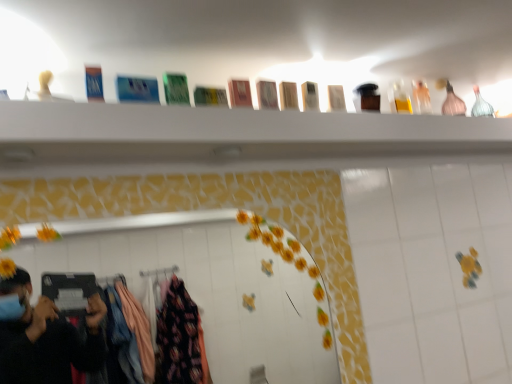
Describe the element at coordinates (230, 135) in the screenshot. I see `wooden boxes at upper center` at that location.

Describe the element at coordinates (215, 289) in the screenshot. This screenshot has width=512, height=384. I see `white glossy mirror at center` at that location.

What is the approximate width of white glossy mirror at center?

white glossy mirror at center is 3.43 centimeters wide.

This screenshot has height=384, width=512. I want to click on wooden boxes at upper center, so click(230, 135).

Would you say pink glass bottle at upper right is inside or outside white glossy mirror at center?

pink glass bottle at upper right is not inside white glossy mirror at center, it's outside.

How many degrees apart are the facing directions of pink glass bottle at upper right and white glossy mirror at center?

The angular difference between pink glass bottle at upper right and white glossy mirror at center is 1.3 degrees.

Is pink glass bottle at upper right touching white glossy mirror at center?

pink glass bottle at upper right is not next to white glossy mirror at center, and they're not touching.

Is wooden boxes at upper center looking in the opposite direction of white glossy mirror at center?

No.

Between wooden boxes at upper center and white glossy mirror at center, which one is positioned behind?

white glossy mirror at center is more distant.

Can you confirm if wooden boxes at upper center is thinner than white glossy mirror at center?

No, wooden boxes at upper center is not thinner than white glossy mirror at center.

Consider the image. From a real-world perspective, is wooden boxes at upper center positioned above or below white glossy mirror at center?

Clearly, from a real-world perspective, wooden boxes at upper center is above white glossy mirror at center.

This screenshot has width=512, height=384. In order to click on mirror that is below the pink glass bottle at upper right (from the image's perspective) in this screenshot , I will do `click(215, 289)`.

Consider the image. Is white glossy mirror at center not inside pink glass bottle at upper right?

white glossy mirror at center is positioned outside pink glass bottle at upper right.

From a real-world perspective, which object stands above the other?

In real-world perspective, pink glass bottle at upper right is above.

Which is farther, (310, 348) or (448, 92)?

The point (310, 348) is farther from the camera.

From a real-world perspective, which object stands above the other?

From a 3D spatial view, pink glass bottle at upper right is above.

Which of these two, pink glass bottle at upper right or wooden boxes at upper center, stands shorter?

wooden boxes at upper center is shorter.

Find the location of `bottle on the right of wooden boxes at upper center`. bottle on the right of wooden boxes at upper center is located at coordinates (453, 103).

Would you say pink glass bottle at upper right is outside wooden boxes at upper center?

pink glass bottle at upper right is positioned outside wooden boxes at upper center.

From a real-world perspective, does white glossy mirror at center stand above wooden boxes at upper center?

No, from a real-world perspective, white glossy mirror at center is not on top of wooden boxes at upper center.

In the scene shown: Considering the sizes of white glossy mirror at center and wooden boxes at upper center in the image, is white glossy mirror at center taller or shorter than wooden boxes at upper center?

In the image, white glossy mirror at center appears to be taller than wooden boxes at upper center.

Are white glossy mirror at center and wooden boxes at upper center beside each other?

white glossy mirror at center is not next to wooden boxes at upper center, and they're not touching.

Could you tell me if white glossy mirror at center is facing wooden boxes at upper center?

No, white glossy mirror at center is not facing towards wooden boxes at upper center.

Considering the sizes of wooden boxes at upper center and pink glass bottle at upper right in the image, is wooden boxes at upper center bigger or smaller than pink glass bottle at upper right?

Considering their sizes, wooden boxes at upper center takes up more space than pink glass bottle at upper right.

From a real-world perspective, which is physically below, wooden boxes at upper center or pink glass bottle at upper right?

From a 3D spatial view, wooden boxes at upper center is below.

Does point (131, 109) appear closer or farther from the camera than point (443, 107)?

Point (131, 109) appears to be closer to the viewer than point (443, 107).

Where is `mirror that appears below the pink glass bottle at upper right (from the image's perspective)`? The width and height of the screenshot is (512, 384). mirror that appears below the pink glass bottle at upper right (from the image's perspective) is located at coordinates (215, 289).

Locate an element on the screen. Image resolution: width=512 pixels, height=384 pixels. closet in front of the white glossy mirror at center is located at coordinates (230, 135).

Looking at the image, which one is located closer to wooden boxes at upper center, white glossy mirror at center or pink glass bottle at upper right?

pink glass bottle at upper right.

Which object lies nearer to the anchor point wooden boxes at upper center, pink glass bottle at upper right or white glossy mirror at center?

pink glass bottle at upper right lies closer to wooden boxes at upper center than the other object.

When comparing their distances from pink glass bottle at upper right, does wooden boxes at upper center or white glossy mirror at center seem further?

Based on the image, white glossy mirror at center appears to be further to pink glass bottle at upper right.

Consider the image. Considering their positions, is white glossy mirror at center positioned further to pink glass bottle at upper right than wooden boxes at upper center?

white glossy mirror at center is further to pink glass bottle at upper right.

Consider the image. Which object lies nearer to the anchor point white glossy mirror at center, pink glass bottle at upper right or wooden boxes at upper center?

wooden boxes at upper center is closer to white glossy mirror at center.

Which object lies nearer to the anchor point white glossy mirror at center, wooden boxes at upper center or pink glass bottle at upper right?

wooden boxes at upper center lies closer to white glossy mirror at center than the other object.

You are a GUI agent. You are given a task and a screenshot of the screen. Output one action in this format:
    pyautogui.click(x=<x>, y=<y>)
    Task: Click on the closet located between white glossy mirror at center and pink glass bottle at upper right in the left-right direction
    
    Given the screenshot: What is the action you would take?
    pyautogui.click(x=230, y=135)